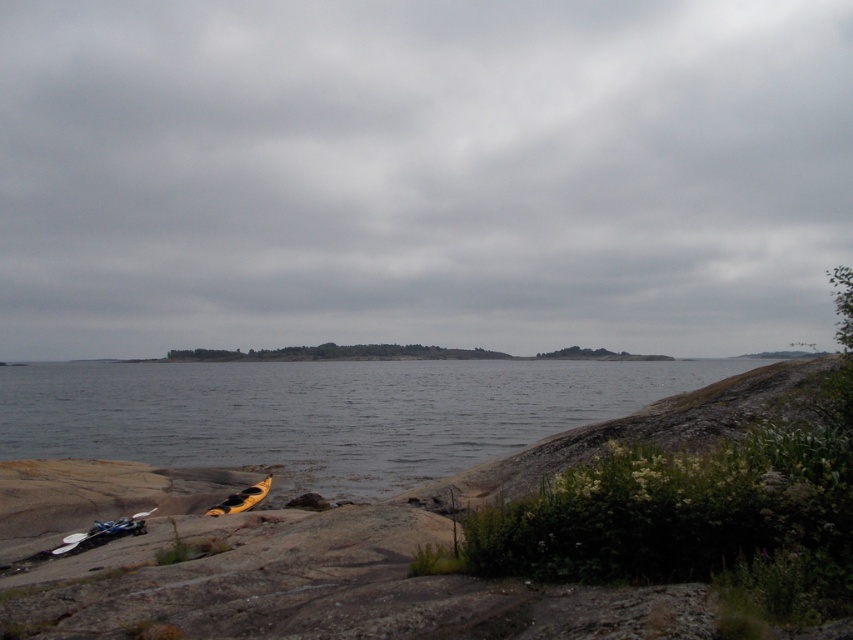
You are a photographer planning to capture the blue plastic kayak at lower left and the clear water at lower left in a single frame. Based on their relative widths, which object will occupy more space horizontally in the photo?

The clear water at lower left has a greater width than the blue plastic kayak at lower left, so it will occupy more horizontal space in the photo.

You are standing at the center of the rocky shoreline and want to reach the clear water at lower left. Which direction should you move to get there?

→ You should move to the lower left direction to reach the clear water at lower left.